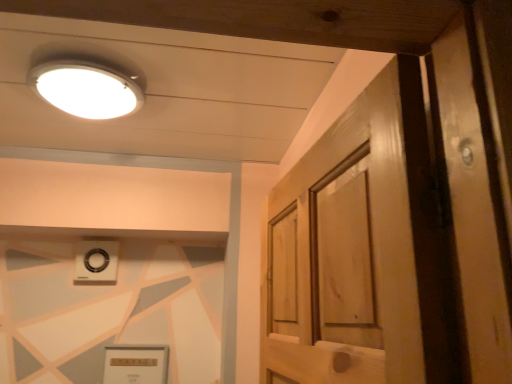
Question: From a real-world perspective, is white plastic knob at upper center physically located above or below matte gold picture frame at lower center?

Choices:
 (A) below
 (B) above

Answer: (B)

Question: In terms of width, does white plastic knob at upper center look wider or thinner when compared to matte gold picture frame at lower center?

Choices:
 (A) thin
 (B) wide

Answer: (B)

Question: Which object is positioned farthest from the white plastic knob at upper center?

Choices:
 (A) white glossy light fixture at upper left
 (B) matte gold picture frame at lower center

Answer: (A)

Question: Based on their relative distances, which object is farther from the matte gold picture frame at lower center?

Choices:
 (A) white glossy light fixture at upper left
 (B) white plastic knob at upper center

Answer: (A)